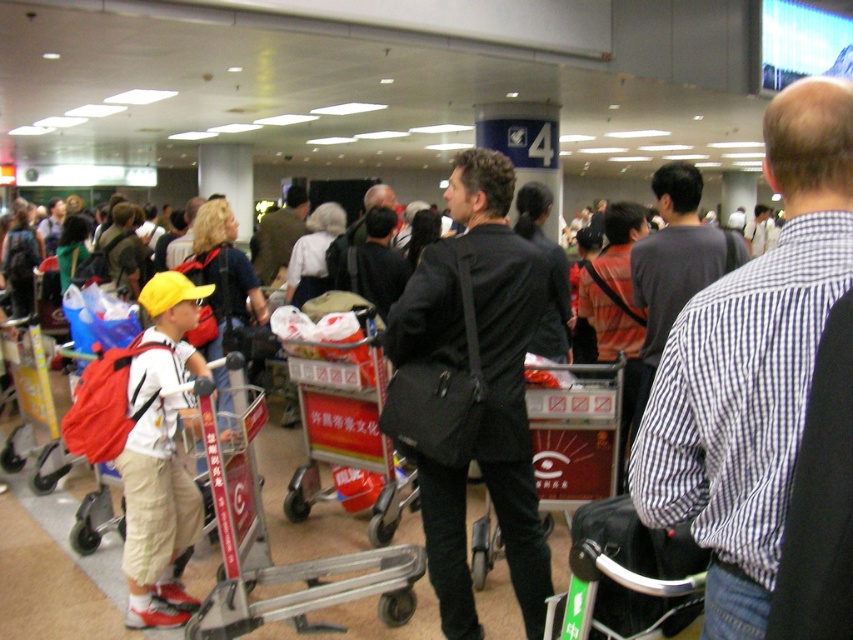
Does point (262, 612) come closer to viewer compared to point (294, 358)?

Yes, it is.

Who is taller, metallic silver trolley at center or metallic red trolley at center?

With more height is metallic red trolley at center.

Is point (410, 545) positioned after point (387, 472)?

No, it is not.

I want to click on metallic silver trolley at center, so click(x=286, y=563).

I want to click on black matte jacket at center, so click(471, 388).

Which is more to the right, black matte jacket at center or metallic silver trolley at center?

black matte jacket at center is more to the right.

Does point (427, 385) lie in front of point (239, 547)?

Yes, point (427, 385) is closer to viewer.

At what (x,y) coordinates should I click in order to perform the action: click on black matte jacket at center. Please return your answer as a coordinate pair (x, y). Looking at the image, I should click on (471, 388).

Which is in front, point (799, 198) or point (144, 442)?

Positioned in front is point (799, 198).

Looking at this image, does white checkered shirt at center have a lesser height compared to matte red backpack at left?

Yes.

Is point (772, 323) closer to camera compared to point (167, 346)?

That is True.

Identify the location of white checkered shirt at center. (751, 368).